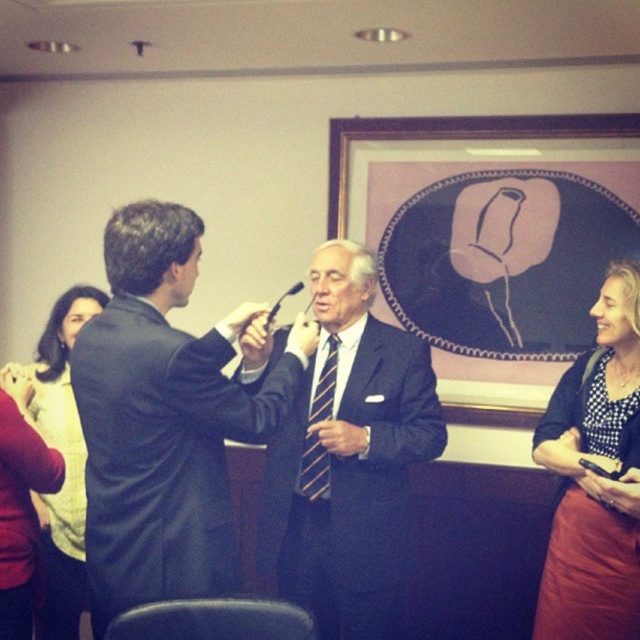
At what (x,y) coordinates should I click in order to perform the action: click on matte black frame at center. Please return your answer as a coordinate pair (x, y). The image size is (640, 640). Looking at the image, I should click on (490, 237).

Which is behind, point (436, 198) or point (56, 632)?

Positioned behind is point (436, 198).

Which is in front, point (406, 209) or point (44, 515)?

Positioned in front is point (44, 515).

The width and height of the screenshot is (640, 640). I want to click on matte black frame at center, so click(x=490, y=237).

Is point (173, 237) closer to camera compared to point (72, 621)?

Yes, point (173, 237) is in front of point (72, 621).

Does dark suit at center have a larger size compared to matte yellow sweater at upper left?

Yes, dark suit at center is bigger than matte yellow sweater at upper left.

Is point (157, 234) positioned after point (76, 616)?

No, (157, 234) is closer to viewer.

Locate an element on the screen. The width and height of the screenshot is (640, 640). dark suit at center is located at coordinates (163, 420).

Looking at this image, is polka dot blouse at right in front of striped fabric tie at center?

That is True.

This screenshot has height=640, width=640. Describe the element at coordinates (595, 477) in the screenshot. I see `polka dot blouse at right` at that location.

This screenshot has height=640, width=640. I want to click on polka dot blouse at right, so click(x=595, y=477).